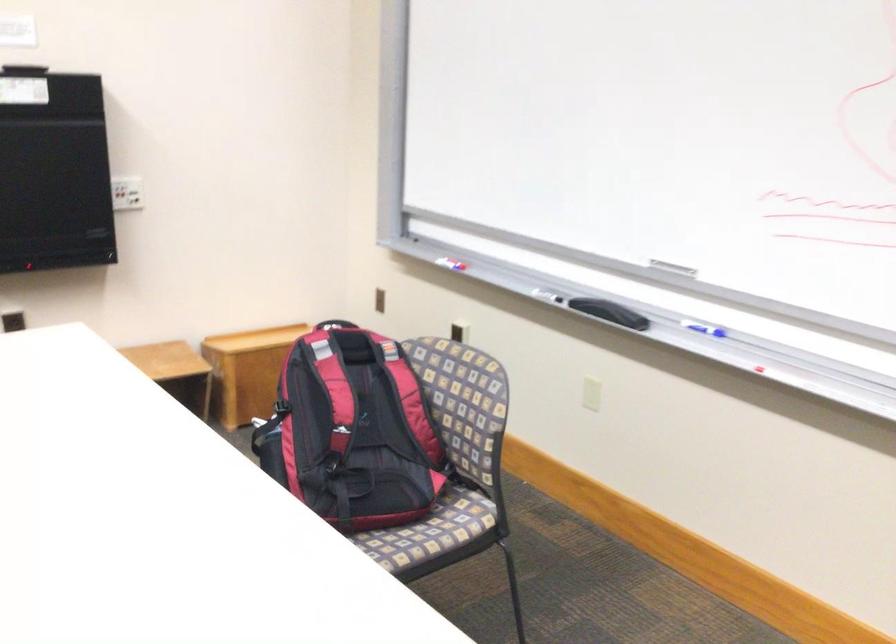
I want to click on black whiteboard eraser, so click(x=672, y=267).